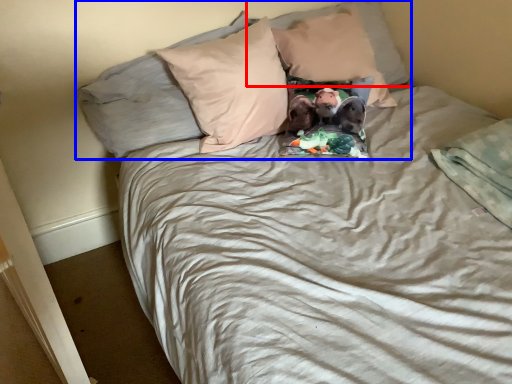
Question: Which object is further to the camera taking this photo, pillow (highlighted by a red box) or pillow (highlighted by a blue box)?

Choices:
 (A) pillow
 (B) pillow

Answer: (A)